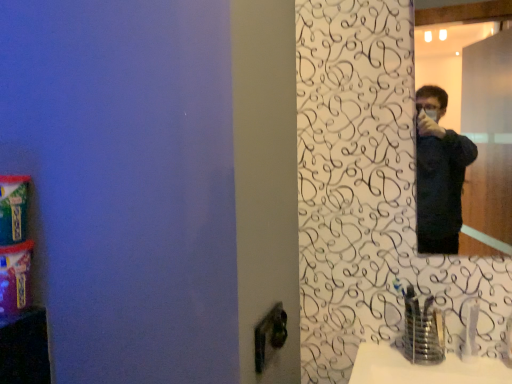
Question: Does point (477, 299) appear closer or farther from the camera than point (415, 349)?

Choices:
 (A) farther
 (B) closer

Answer: (A)

Question: In terms of height, does white plastic faucet at lower right, which is counted as the second faucet, starting from the left, look taller or shorter compared to satin nickel faucet at lower right, the second faucet positioned from the right?

Choices:
 (A) short
 (B) tall

Answer: (A)

Question: Considering the real-world distances, which object is farthest from the white plastic faucet at lower right, which is the 1th faucet from right to left?

Choices:
 (A) black matte mirror at upper right
 (B) satin nickel faucet at lower right, the first faucet in the left-to-right sequence

Answer: (A)

Question: Which object is the closest to the white plastic faucet at lower right, which is counted as the second faucet, starting from the left?

Choices:
 (A) satin nickel faucet at lower right, the first faucet in the left-to-right sequence
 (B) black matte mirror at upper right

Answer: (A)